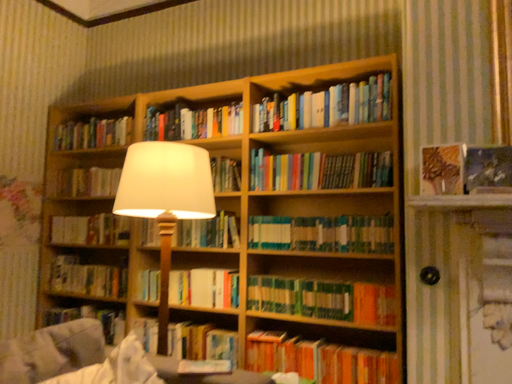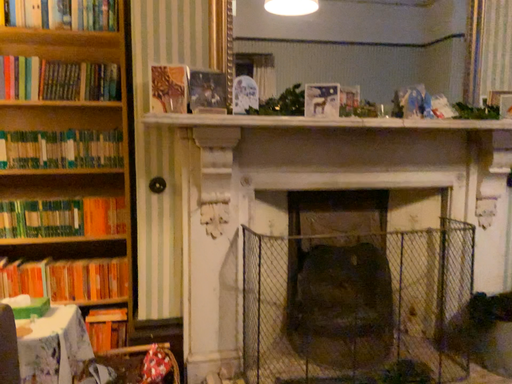
Question: How did the camera likely rotate when shooting the video?

Choices:
 (A) rotated right
 (B) rotated left

Answer: (A)